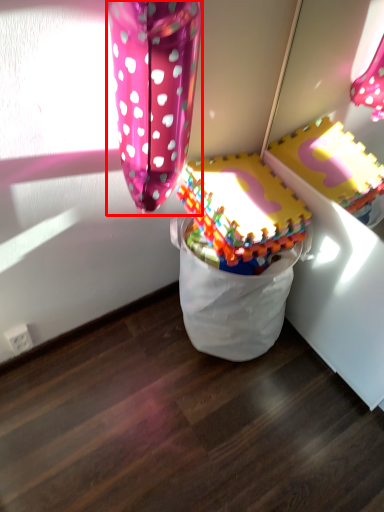
Question: From the image, what is the correct spatial relationship of balloon (annotated by the red box) in relation to toy?

Choices:
 (A) left
 (B) right

Answer: (A)